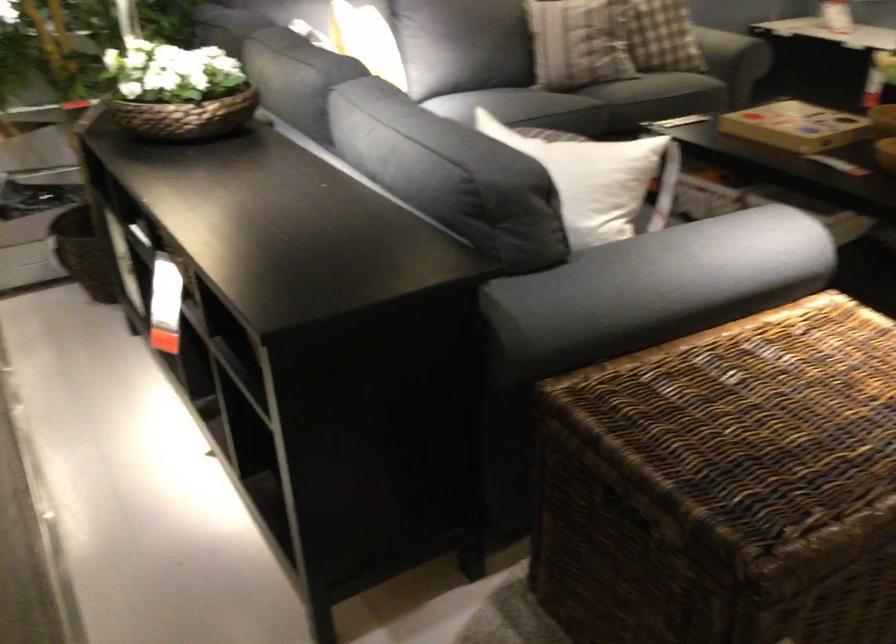
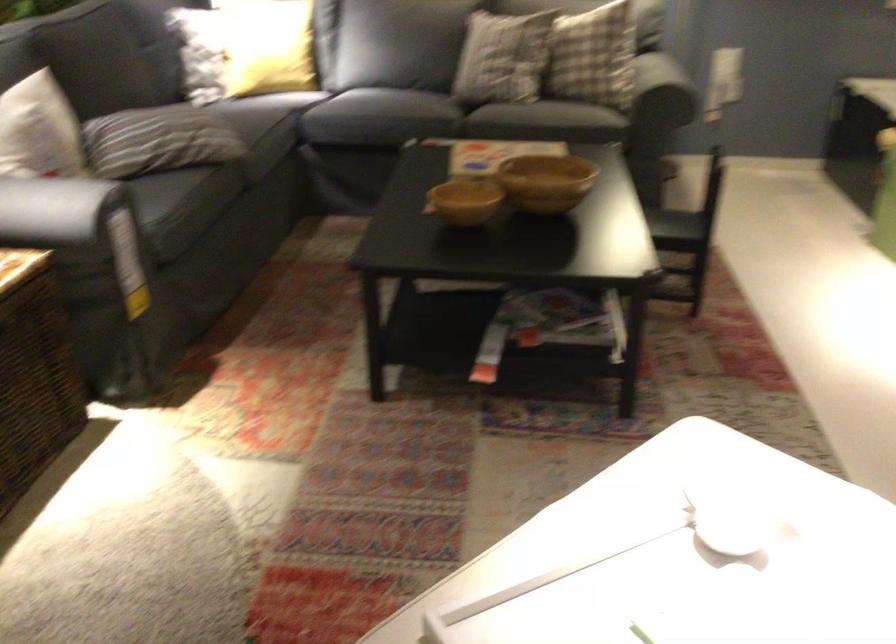
Question: The images are taken continuously from a first-person perspective. In which direction are you moving?

Choices:
 (A) Left
 (B) Right
 (C) Forward
 (D) Backward

Answer: (B)